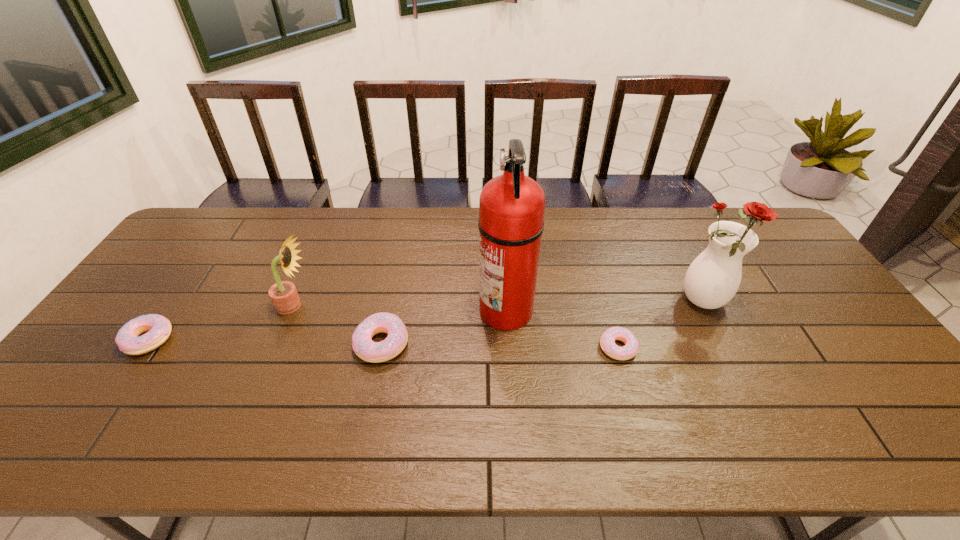
Image resolution: width=960 pixels, height=540 pixels. What are the coordinates of `object at the left edge` in the screenshot? It's located at (128, 339).

Locate an element on the screen. The width and height of the screenshot is (960, 540). free region at the far edge of the desktop is located at coordinates (450, 237).

Where is `free spot at the near edge of the desktop`? The image size is (960, 540). free spot at the near edge of the desktop is located at coordinates (831, 396).

In the image, there is a desktop. Where is `vacant space at the right edge`? vacant space at the right edge is located at coordinates tap(794, 300).

I want to click on free space at the far right corner, so click(x=774, y=244).

Identify the location of vacant space that's between the fifth object from right to left and the fourth tallest object. Image resolution: width=960 pixels, height=540 pixels. point(338,325).

At what (x,y) coordinates should I click in order to perform the action: click on vacant area that lies between the fifth object from right to left and the fourth object from right to left. Please return your answer as a coordinate pair (x, y). This screenshot has height=540, width=960. Looking at the image, I should click on (338, 325).

Find the location of a particular element. The width and height of the screenshot is (960, 540). free spot between the vase and the second object from right to left is located at coordinates (661, 325).

Locate an element on the screen. The height and width of the screenshot is (540, 960). free space between the tallest object and the leftmost doughnut is located at coordinates (327, 325).

You are a GUI agent. You are given a task and a screenshot of the screen. Output one action in this format:
    pyautogui.click(x=<x>, y=<y>)
    Task: Click on the vacant space that's between the fourth object from right to left and the fifth object from right to left
    This screenshot has width=960, height=540.
    Given the screenshot: What is the action you would take?
    pyautogui.click(x=338, y=325)